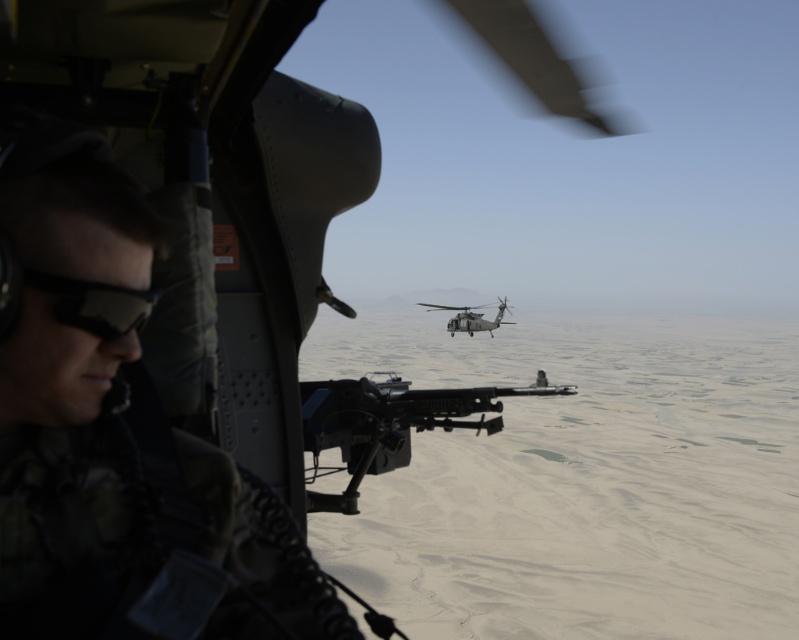
Question: Can you confirm if black matte goggles at left is positioned above dark gray metallic helicopter at center?

Choices:
 (A) yes
 (B) no

Answer: (B)

Question: Which object is positioned closest to the black matte goggles at left?

Choices:
 (A) matte black rifle at center
 (B) camo fabric uniform at left
 (C) dark gray metallic helicopter at center

Answer: (B)

Question: Which object is farther from the camera taking this photo?

Choices:
 (A) black matte goggles at left
 (B) dark gray metallic helicopter at center
 (C) camo fabric uniform at left
 (D) matte black rifle at center

Answer: (B)

Question: Can you confirm if camo fabric uniform at left is positioned to the left of dark gray metallic helicopter at center?

Choices:
 (A) no
 (B) yes

Answer: (B)

Question: Which of the following is the closest to the observer?

Choices:
 (A) black matte goggles at left
 (B) camo fabric uniform at left
 (C) matte black rifle at center

Answer: (B)

Question: Does matte black rifle at center have a greater width compared to black matte goggles at left?

Choices:
 (A) no
 (B) yes

Answer: (B)